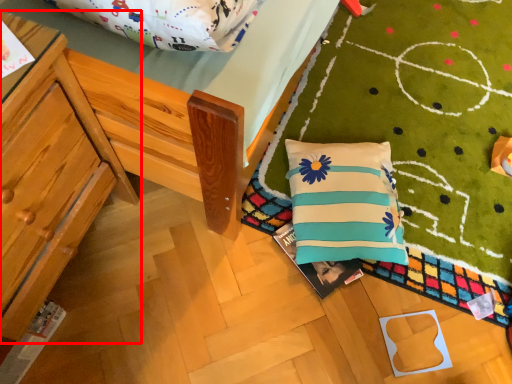
Question: From the image's perspective, what is the correct spatial positioning of furniture (annotated by the red box) in reference to pillow?

Choices:
 (A) below
 (B) above

Answer: (A)